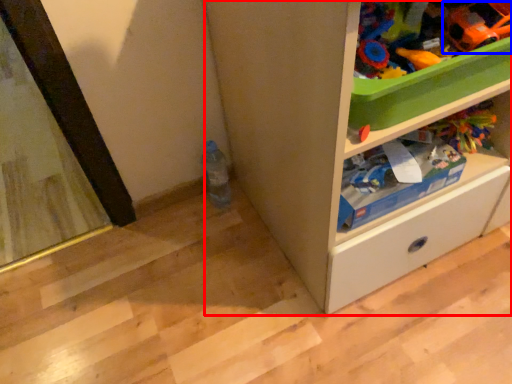
Question: Which object is closer to the camera taking this photo, cabinetry (highlighted by a red box) or toy (highlighted by a blue box)?

Choices:
 (A) cabinetry
 (B) toy

Answer: (A)